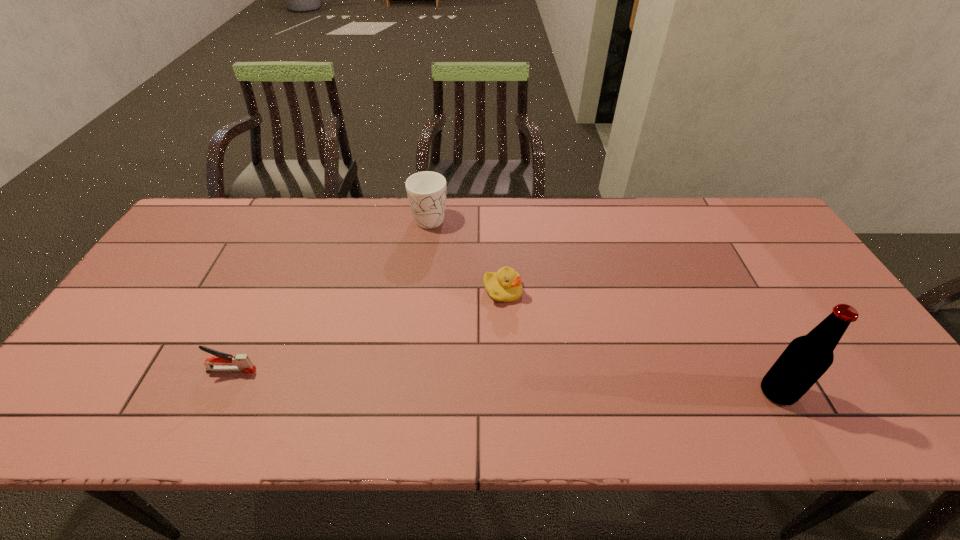
Locate an element on the screen. vacant spot on the desktop that is between the stapler and the tallest object and is positioned on the side of the second tallest object with the handle is located at coordinates pos(481,380).

Where is `free spot on the desktop that is between the second nearest object and the rightmost object and is positioned on the front-facing side of the third nearest object`? Image resolution: width=960 pixels, height=540 pixels. free spot on the desktop that is between the second nearest object and the rightmost object and is positioned on the front-facing side of the third nearest object is located at coordinates (575, 384).